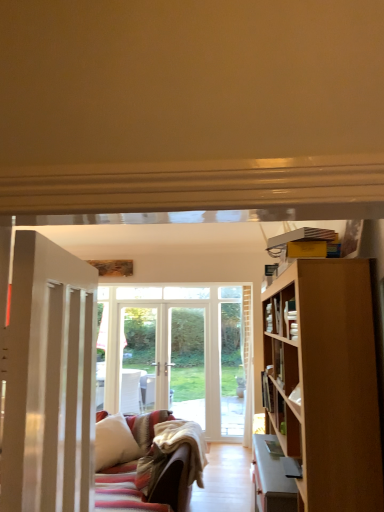
Question: From a real-world perspective, relative to hardcover book at right, is wooden bookshelf at right vertically above or below?

Choices:
 (A) above
 (B) below

Answer: (A)

Question: Is point (296, 316) positioned closer to the camera than point (269, 390)?

Choices:
 (A) closer
 (B) farther

Answer: (A)

Question: Which of these objects is positioned farthest from the white painted wood door at left?

Choices:
 (A) hardcover book at right
 (B) wooden bookshelf at right
 (C) white soft pillow at lower left

Answer: (C)

Question: Based on their relative distances, which object is farther from the white painted wood door at left?

Choices:
 (A) wooden bookshelf at right
 (B) white soft pillow at lower left
 (C) hardcover book at right

Answer: (B)